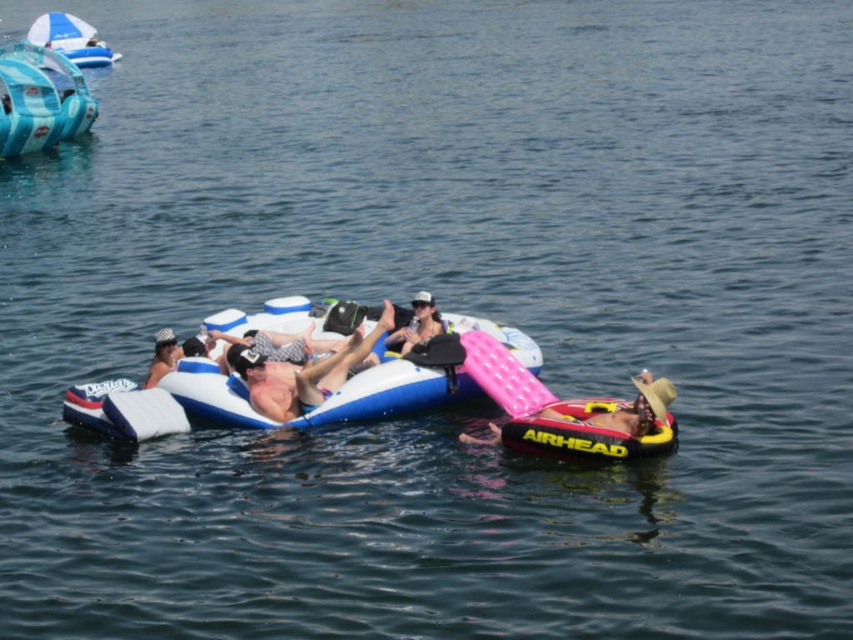
Is blue glossy umbrella at upper left thinner than matte white skin at center?

Incorrect, blue glossy umbrella at upper left's width is not less than matte white skin at center's.

Is blue glossy umbrella at upper left closer to camera compared to matte white skin at center?

No, it is behind matte white skin at center.

Is point (80, 49) positioned before point (155, 372)?

No, it is behind (155, 372).

I want to click on blue glossy umbrella at upper left, so click(71, 38).

How much distance is there between pink inflatable float at lower right and matte black bag at center?

They are 30.16 feet apart.

Can you confirm if pink inflatable float at lower right is thinner than matte black bag at center?

Indeed, pink inflatable float at lower right has a lesser width compared to matte black bag at center.

Which is behind, point (627, 428) or point (387, 336)?

Point (387, 336)

At what (x,y) coordinates should I click in order to perform the action: click on pink inflatable float at lower right. Please return your answer as a coordinate pair (x, y). The height and width of the screenshot is (640, 853). Looking at the image, I should click on (625, 410).

Image resolution: width=853 pixels, height=640 pixels. What do you see at coordinates (247, 400) in the screenshot?
I see `blue inflatable raft at center` at bounding box center [247, 400].

Between blue inflatable raft at center and blue glossy umbrella at upper left, which one appears on the left side from the viewer's perspective?

From the viewer's perspective, blue glossy umbrella at upper left appears more on the left side.

Is point (167, 381) closer to viewer compared to point (80, 35)?

Yes.

The image size is (853, 640). I want to click on blue inflatable raft at center, so click(247, 400).